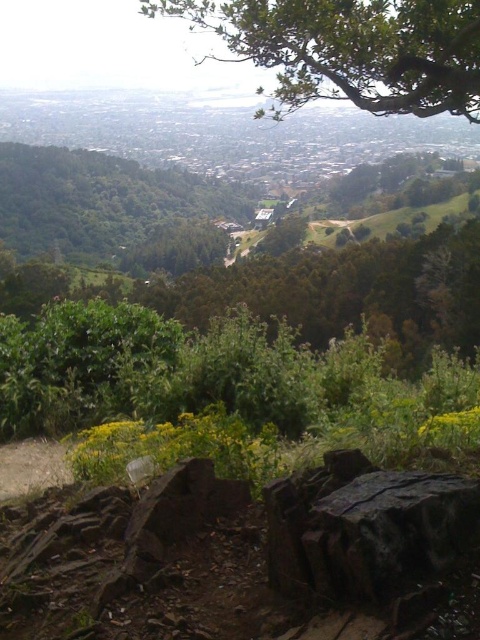
Question: Can you confirm if green leafy tree at upper center is thinner than green leafy tree at center?

Choices:
 (A) yes
 (B) no

Answer: (A)

Question: Is green leafy tree at upper center below green leafy tree at center?

Choices:
 (A) yes
 (B) no

Answer: (B)

Question: Can you confirm if green leafy tree at upper center is smaller than green leafy tree at center?

Choices:
 (A) no
 (B) yes

Answer: (A)

Question: Which point is closer to the camera taking this photo?

Choices:
 (A) (94, 234)
 (B) (444, 104)

Answer: (B)

Question: Which point is farther to the camera?

Choices:
 (A) green leafy tree at upper center
 (B) green leafy tree at center

Answer: (B)

Question: Which object is closer to the camera taking this photo?

Choices:
 (A) green leafy tree at upper center
 (B) green leafy tree at center

Answer: (A)